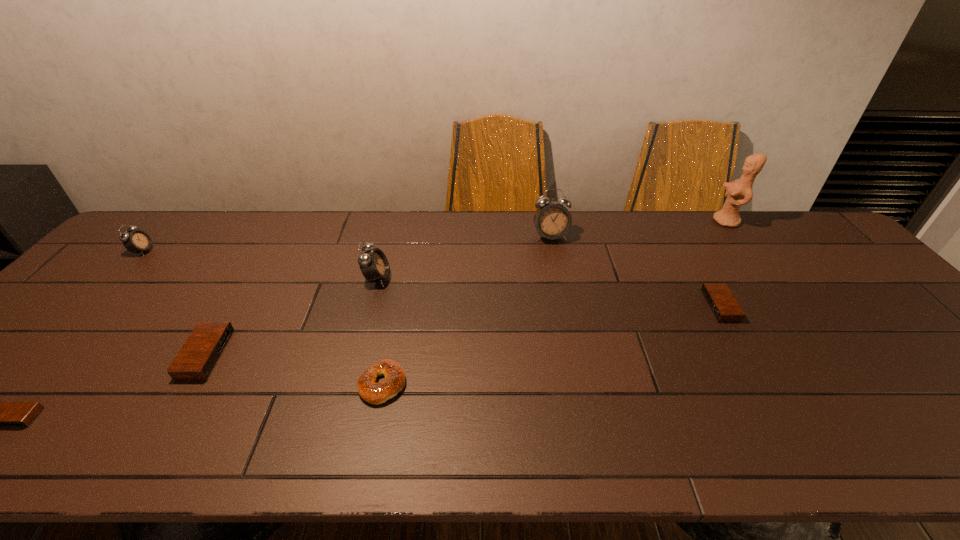
Where is `vacant space situated on the right of the bagel`? Image resolution: width=960 pixels, height=540 pixels. vacant space situated on the right of the bagel is located at coordinates (576, 384).

Find the location of `vacant space situated 0.350m on the front face of the second biggest black alarm clock`. vacant space situated 0.350m on the front face of the second biggest black alarm clock is located at coordinates (576, 306).

The image size is (960, 540). Find the location of `vacant space located on the front face of the second biggest black alarm clock`. vacant space located on the front face of the second biggest black alarm clock is located at coordinates (613, 306).

The image size is (960, 540). I want to click on vacant space situated 0.060m on the front face of the second biggest black alarm clock, so 685,306.

This screenshot has height=540, width=960. What are the coordinates of `figurine present at the far edge` in the screenshot? It's located at [739, 192].

At what (x,y) coordinates should I click in order to perform the action: click on object that is at the left edge. Please return your answer as a coordinate pair (x, y). Looking at the image, I should click on (136, 240).

Find the location of a particular element. This screenshot has height=540, width=960. object at the far left corner is located at coordinates (136, 240).

Where is `vacant space at the far edge`? vacant space at the far edge is located at coordinates (768, 242).

Where is `vacant space at the near edge of the desktop`? vacant space at the near edge of the desktop is located at coordinates (154, 443).

Locate an element on the screen. This screenshot has height=540, width=960. vacant space at the left edge of the desktop is located at coordinates (91, 291).